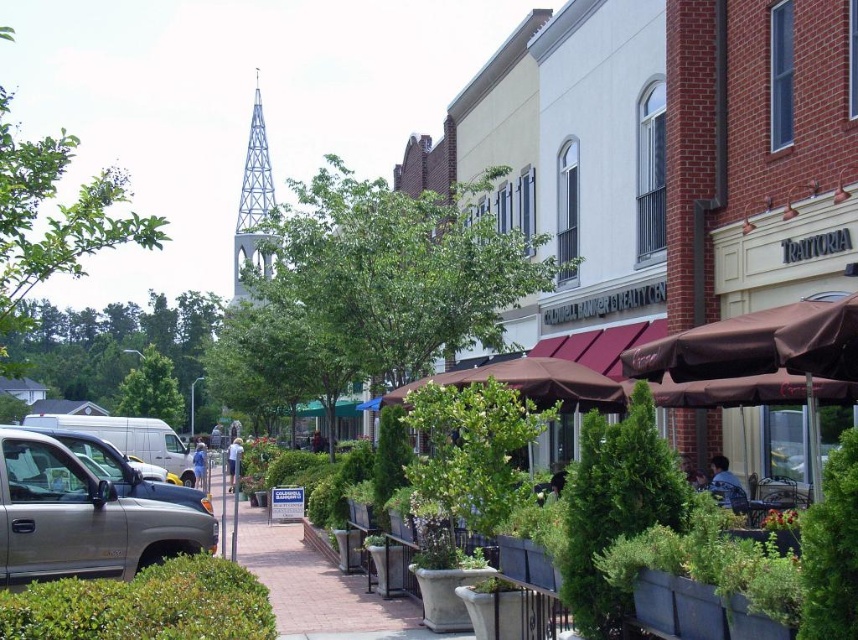
You are a delivery person standing at the sidewalk with a 2.5 meter long ladder. You need to carry the ladder from the brown fabric umbrella at right to the parked silver pickup truck on the left. Can you move the ladder without tilting it?

The distance between the brown fabric umbrella at right and the parked silver pickup truck on the left is 30.12 meters. Since the ladder is only 2.5 meters long, you can move it without tilting as the distance is more than sufficient.

You are a pedestrian walking on the sidewalk and want to reach the brown fabric umbrella at center. There is a gold metallic truck at lower left blocking your path. Can you walk around the truck to get to the umbrella?

The gold metallic truck at lower left is in front of the brown fabric umbrella at center, so you can walk around the truck to reach the umbrella since it is blocking the direct path.

You are standing at the camera position and want to take a photo of the gold metallic truck at lower left. Is the truck within the camera range of 40 meters? Please explain your reasoning.

The gold metallic truck at lower left is 39.06 meters away from the camera. Since the camera range is 40 meters, the truck is within range and can be photographed.